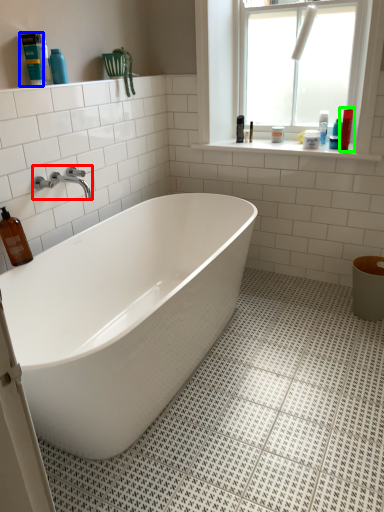
Question: Which is nearer to the tap (highlighted by a red box)? cleaning product (highlighted by a blue box) or cleaning product (highlighted by a green box).

Choices:
 (A) cleaning product
 (B) cleaning product

Answer: (A)